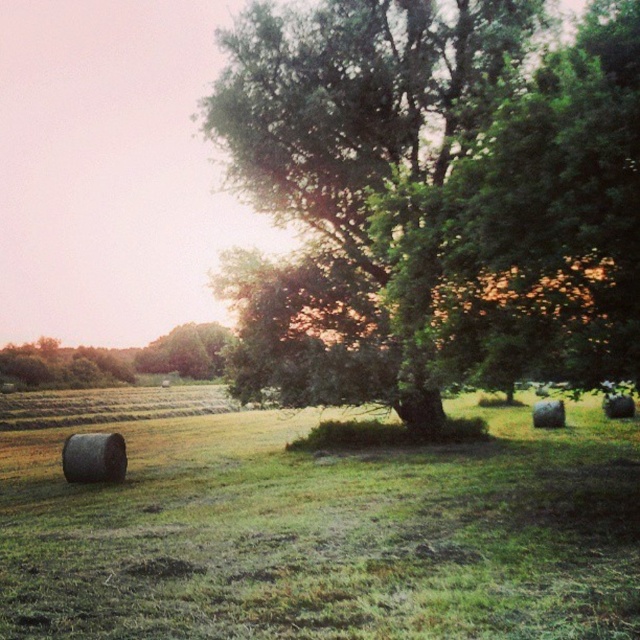
You are a landscape photographer planning to capture the green leafy tree at center and the green grass at lower left in the same frame. Based on their sizes, which object should you focus on to ensure both fit in the composition without cropping?

The green leafy tree at center has a smaller width compared to the green grass at lower left. To include both in the frame without cropping, focus on positioning the green leafy tree at center first since it is narrower, allowing space for the wider green grass at lower left.

You are standing at the center of the grassy field. Which direction should you walk to reach the green leafy tree at center?

The green leafy tree at center is located at point coordinates of 0.309 on the x axis and 0.678 on the y axis. Since you are at the center of the field, you should walk towards the right and slightly upwards to reach the green leafy tree at center.